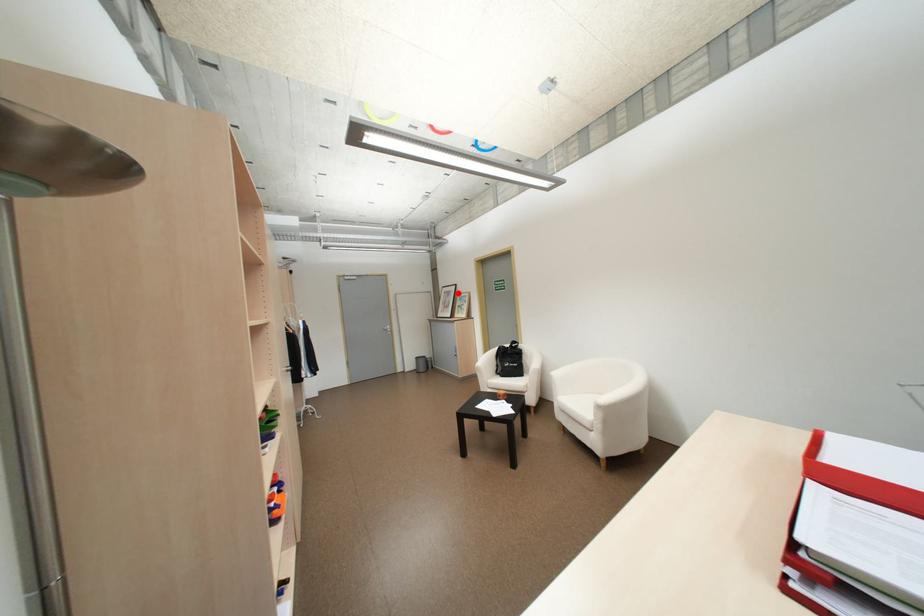
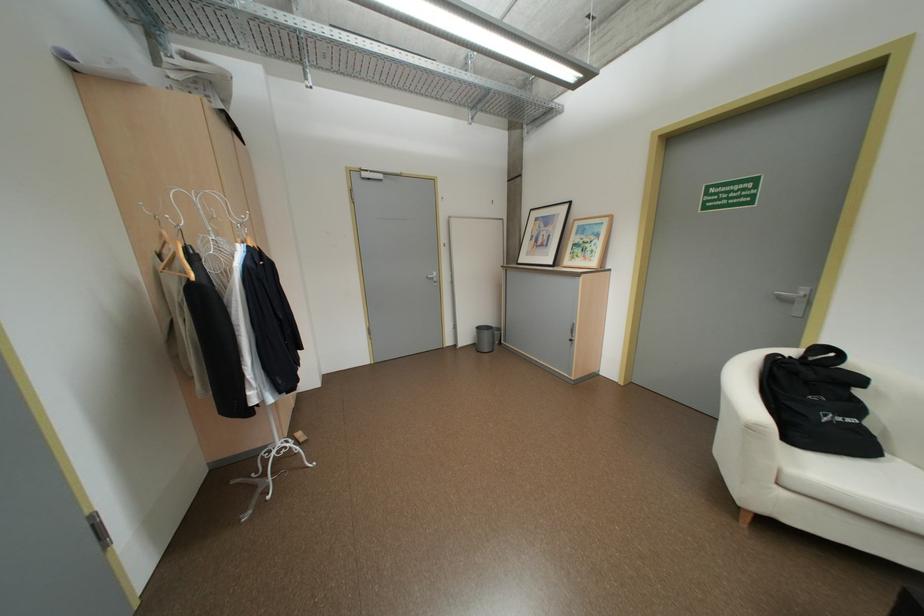
Where in the second image is the point corresponding to the highlighted location from the first image?

(556, 220)